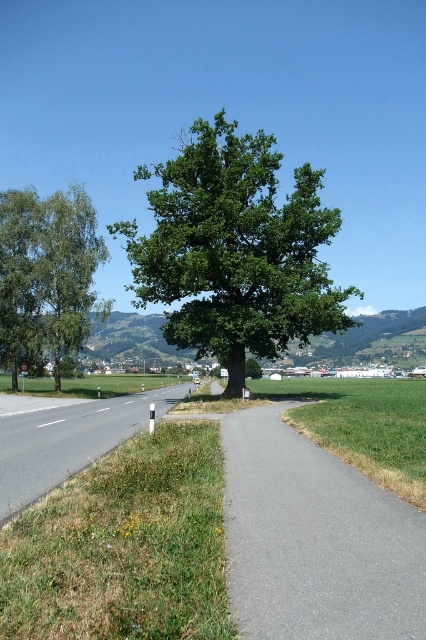
You are a hiker walking along the paved path in the rural landscape. You want to reach the green grass at lower left to rest. Which direction should you walk relative to the green leafy tree at center?

The green leafy tree at center is positioned on the right side of green grass at lower left. To reach the green grass at lower left, you should walk to the left of the green leafy tree at center.